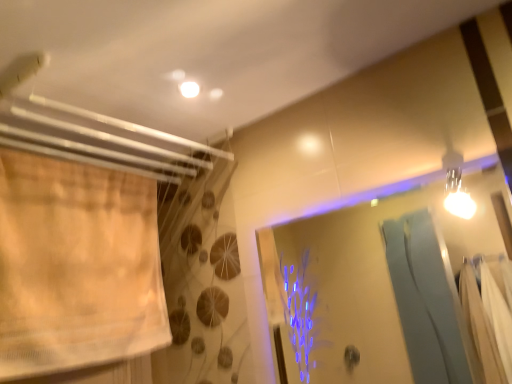
Question: Is beige sheer curtain at left to the right of transparent glass screen door at upper right from the viewer's perspective?

Choices:
 (A) yes
 (B) no

Answer: (B)

Question: Is beige sheer curtain at left aimed at transparent glass screen door at upper right?

Choices:
 (A) no
 (B) yes

Answer: (B)

Question: Is beige sheer curtain at left thinner than transparent glass screen door at upper right?

Choices:
 (A) yes
 (B) no

Answer: (B)

Question: Can you confirm if beige sheer curtain at left is positioned to the left of transparent glass screen door at upper right?

Choices:
 (A) no
 (B) yes

Answer: (B)

Question: Are beige sheer curtain at left and transparent glass screen door at upper right located far from each other?

Choices:
 (A) no
 (B) yes

Answer: (B)

Question: Can you confirm if beige sheer curtain at left is bigger than transparent glass screen door at upper right?

Choices:
 (A) no
 (B) yes

Answer: (B)

Question: Can you confirm if transparent glass screen door at upper right is taller than beige sheer curtain at left?

Choices:
 (A) yes
 (B) no

Answer: (B)

Question: Is transparent glass screen door at upper right bigger than beige sheer curtain at left?

Choices:
 (A) no
 (B) yes

Answer: (A)

Question: Can you confirm if transparent glass screen door at upper right is thinner than beige sheer curtain at left?

Choices:
 (A) yes
 (B) no

Answer: (A)

Question: From the image's perspective, is transparent glass screen door at upper right located beneath beige sheer curtain at left?

Choices:
 (A) no
 (B) yes

Answer: (B)

Question: Are transparent glass screen door at upper right and beige sheer curtain at left making contact?

Choices:
 (A) yes
 (B) no

Answer: (B)

Question: From the image's perspective, is transparent glass screen door at upper right located above beige sheer curtain at left?

Choices:
 (A) yes
 (B) no

Answer: (B)

Question: In the image, is beige sheer curtain at left on the left side or the right side of transparent glass screen door at upper right?

Choices:
 (A) left
 (B) right

Answer: (A)